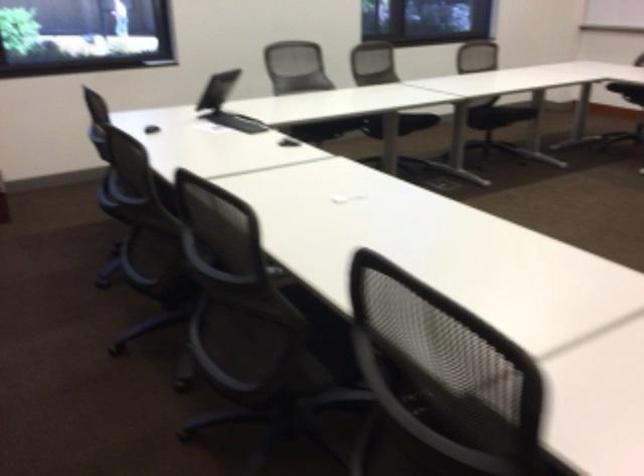
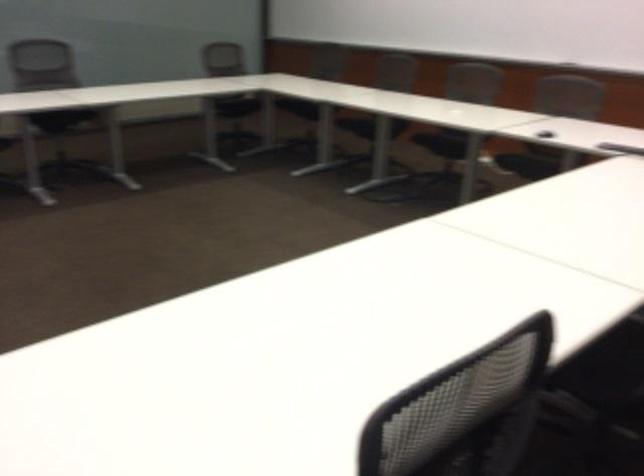
The first image is from the beginning of the video and the second image is from the end. How did the camera likely rotate when shooting the video?

The camera's rotation is toward right-down.